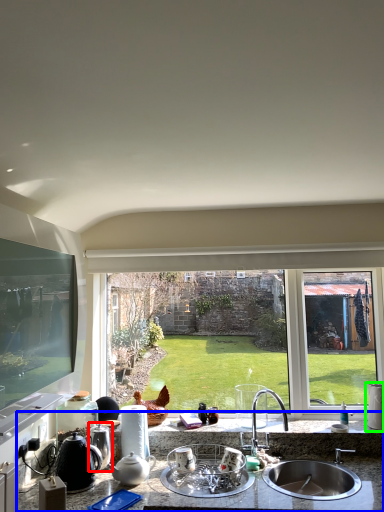
Question: Estimate the real-world distances between objects in this image. Which object is closer to appliance (highlighted by a red box), countertop (highlighted by a blue box) or appliance (highlighted by a green box)?

Choices:
 (A) countertop
 (B) appliance

Answer: (A)